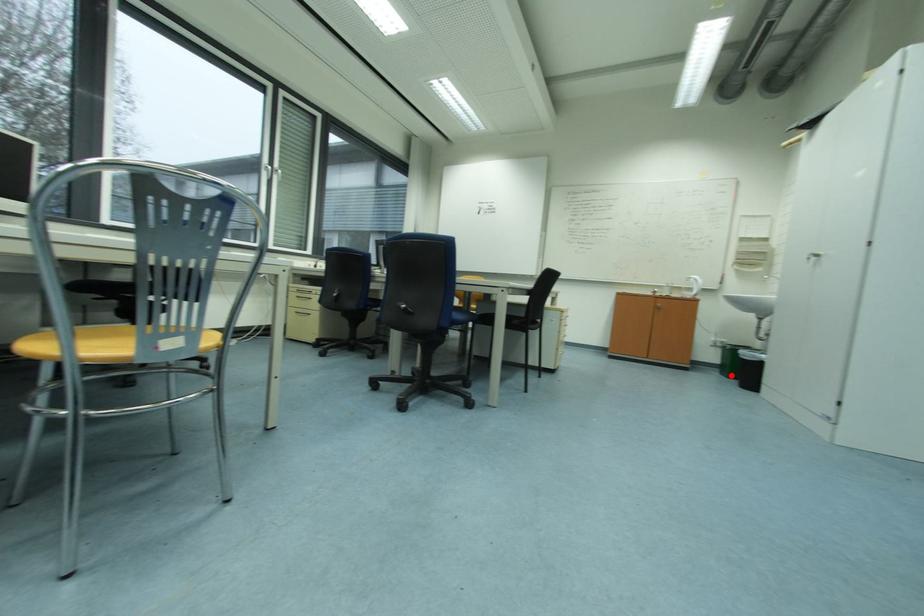
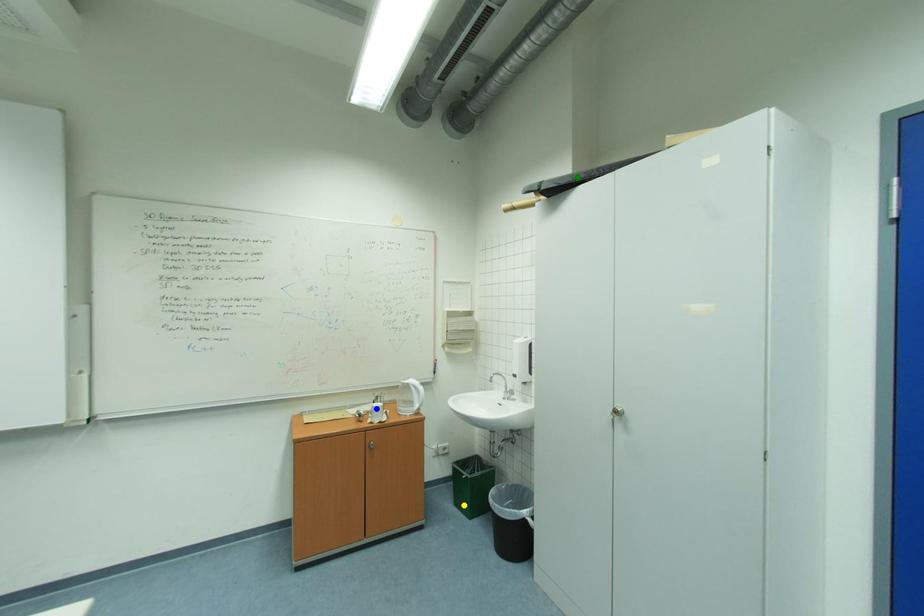
Question: I am providing you with two images of the same scene from different viewpoints. A red point is marked on the first image. You are given multiple points on the second image. Which point in image 2 is actually the same real-world point as the red point in image 1?

Choices:
 (A) blue point
 (B) yellow point
 (C) green point

Answer: (B)